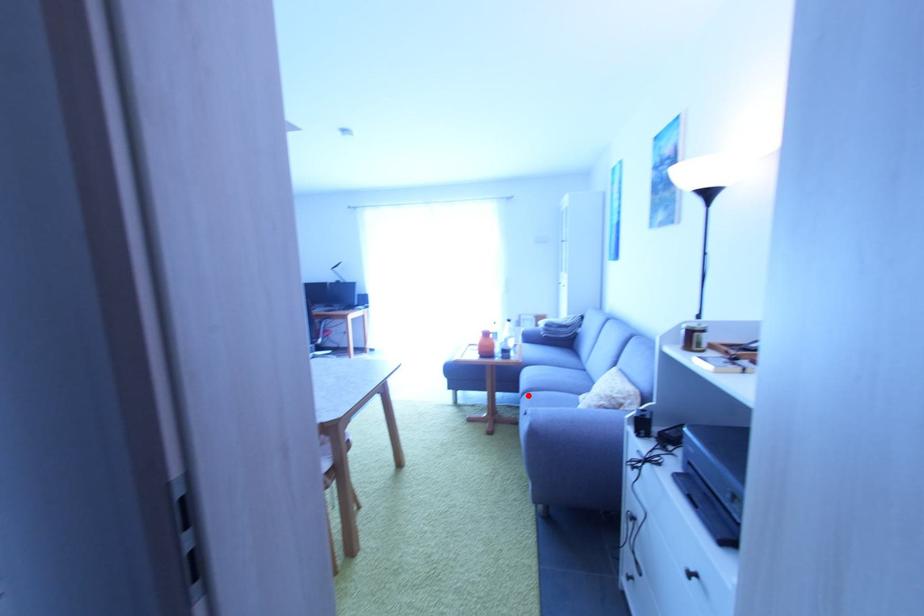
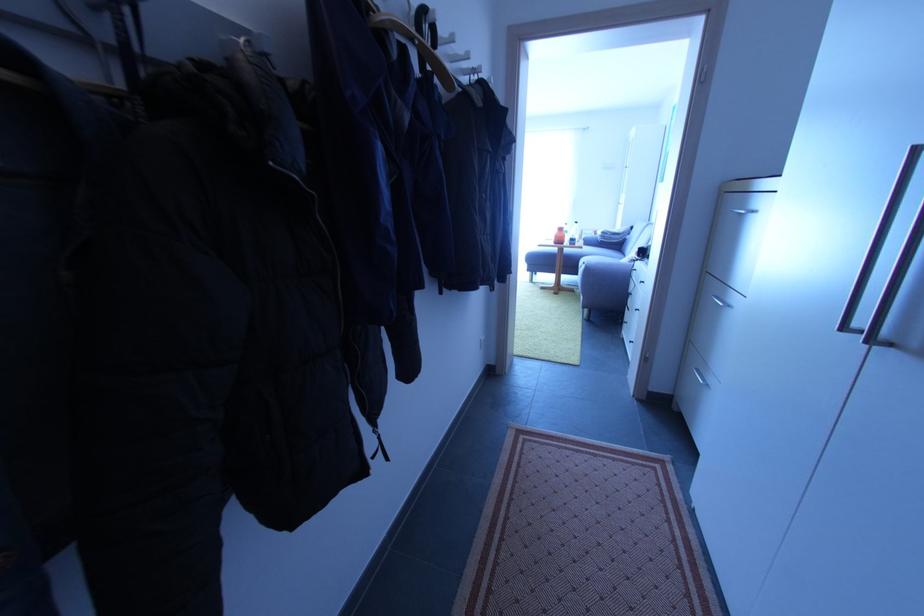
Locate, in the second image, the point that corresponds to the highlighted location in the first image.

(586, 268)